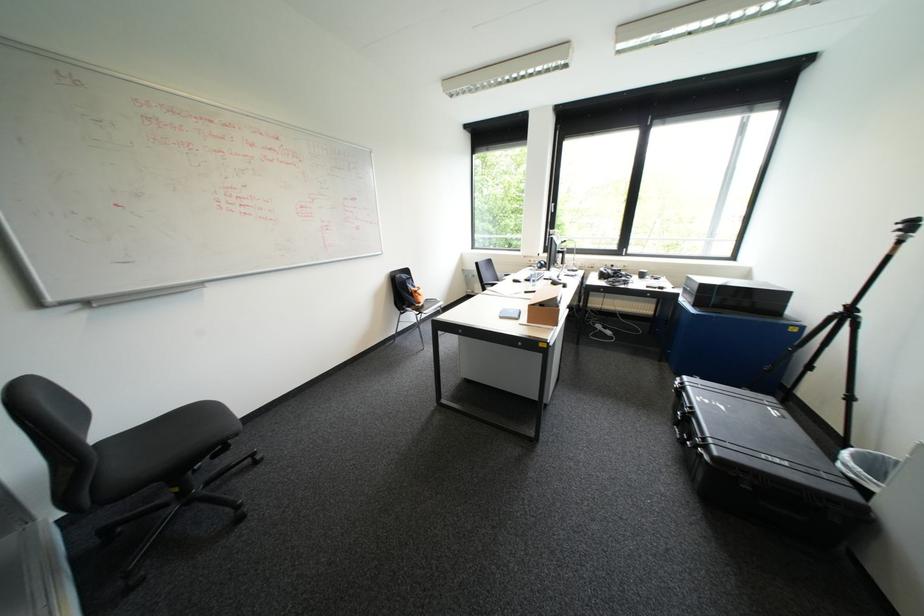
What do you see at coordinates (695, 446) in the screenshot? The image size is (924, 616). I see `the black case latch` at bounding box center [695, 446].